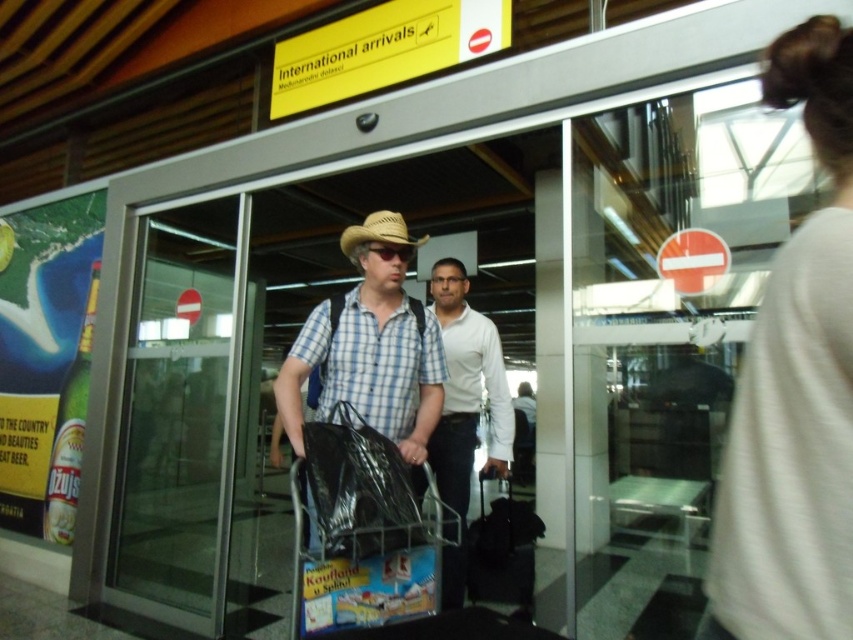
Does white cotton shirt at upper right have a lesser height compared to black fabric suitcase at lower right?

No.

Is point (840, 81) more distant than point (531, 592)?

No, it is not.

Does point (814, 435) come closer to viewer compared to point (523, 536)?

Yes, it is in front of point (523, 536).

The height and width of the screenshot is (640, 853). I want to click on white cotton shirt at upper right, so click(x=793, y=388).

Who is taller, transparent glass door at center or white smooth shirt at center?

transparent glass door at center is taller.

Does transparent glass door at center appear on the left side of white smooth shirt at center?

Correct, you'll find transparent glass door at center to the left of white smooth shirt at center.

Does point (115, 564) come farther from viewer compared to point (456, 492)?

Yes, point (115, 564) is farther from viewer.

Identify the location of transparent glass door at center. (178, 403).

Is transparent glass door at center positioned before black fabric suitcase at lower right?

No, it is not.

Is point (109, 556) in front of point (512, 502)?

Yes, point (109, 556) is in front of point (512, 502).

This screenshot has width=853, height=640. What are the coordinates of `transparent glass door at center` in the screenshot? It's located at (178, 403).